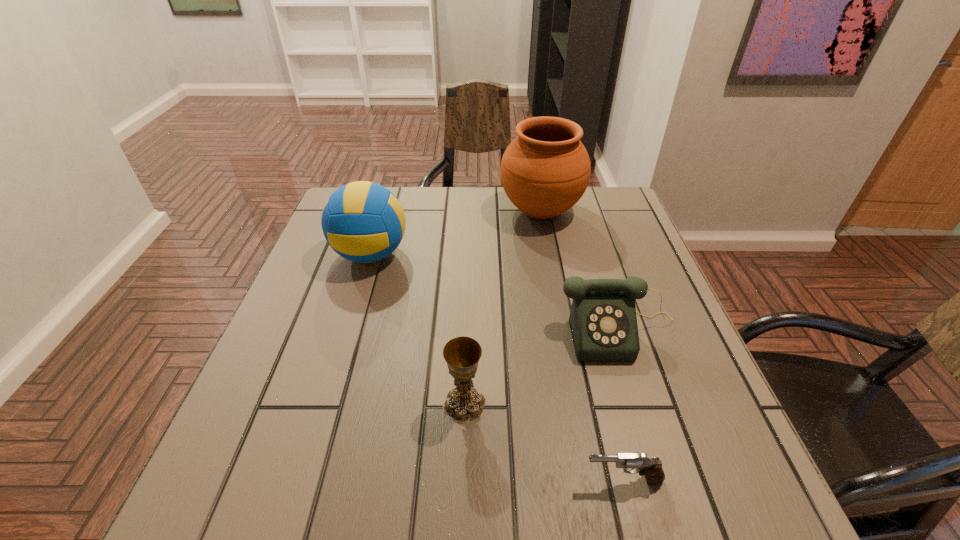
Select which object is the closest to the third nearest object. Please provide its 2D coordinates. Your answer should be formatted as a tuple, i.e. [(x, y)], where the tuple contains the x and y coordinates of a point satisfying the conditions above.

[(462, 354)]

Where is `blank area in the image that satisfies the following two spatial constraints: 1. on the front side of the second object from left to right; 2. on the right side of the volleyball`? blank area in the image that satisfies the following two spatial constraints: 1. on the front side of the second object from left to right; 2. on the right side of the volleyball is located at coordinates (325, 404).